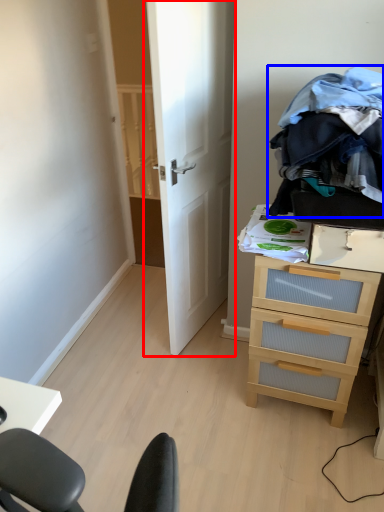
Question: Which of the following is the farthest to the observer, door (highlighted by a red box) or clothing (highlighted by a blue box)?

Choices:
 (A) door
 (B) clothing

Answer: (A)